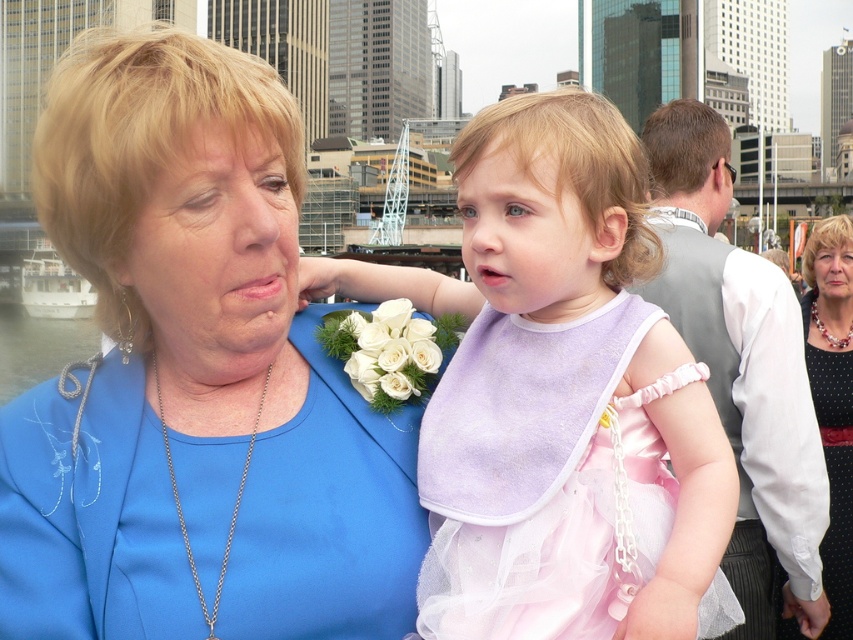
What do you see at coordinates (194, 378) in the screenshot? The image size is (853, 640). I see `blue satin dress at upper left` at bounding box center [194, 378].

Is blue satin dress at upper left thinner than gray fabric vest at right?

Incorrect, blue satin dress at upper left's width is not less than gray fabric vest at right's.

Is point (136, 54) farther from camera compared to point (746, 387)?

No, (136, 54) is closer to viewer.

Locate an element on the screen. blue satin dress at upper left is located at coordinates (194, 378).

In the scene shown: Does pink satin dress at center have a greater height compared to gray fabric vest at right?

No, pink satin dress at center is not taller than gray fabric vest at right.

Does point (498, 205) come closer to viewer compared to point (666, 298)?

Yes, point (498, 205) is in front of point (666, 298).

Measure the distance between point (x=438, y=410) and camera.

Point (x=438, y=410) and camera are 42.62 meters apart.

Find the location of a particular element. pink satin dress at center is located at coordinates (570, 342).

Is pink satin dress at center smaller than black dotted dress at center?

Correct, pink satin dress at center occupies less space than black dotted dress at center.

Can you confirm if pink satin dress at center is thinner than black dotted dress at center?

No.

Which is in front, point (677, 628) or point (824, 632)?

Positioned in front is point (677, 628).

At what (x,y) coordinates should I click in order to perform the action: click on pink satin dress at center. Please return your answer as a coordinate pair (x, y). Looking at the image, I should click on (570, 342).